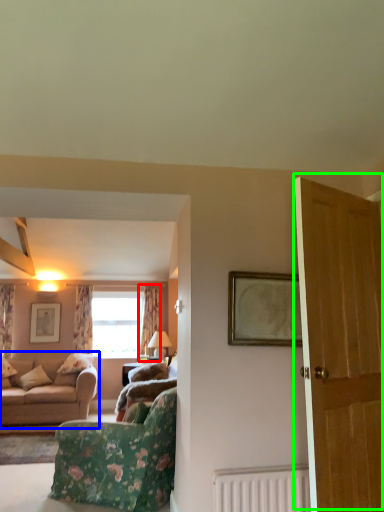
Question: Considering the real-world distances, which object is closest to curtain (highlighted by a red box)? studio couch (highlighted by a blue box) or door (highlighted by a green box).

Choices:
 (A) studio couch
 (B) door

Answer: (A)